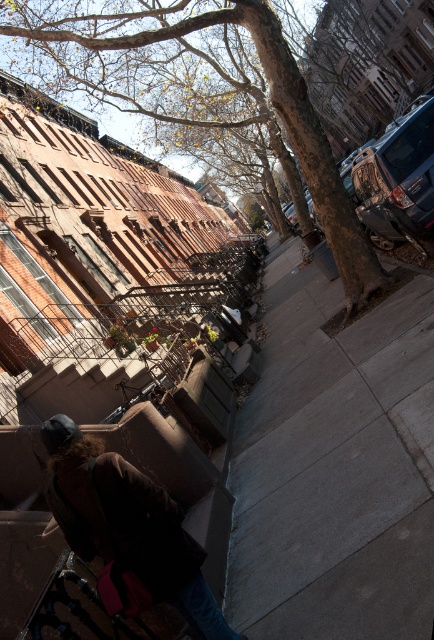
Question: Is brown textured tree at upper center below dark brown leather jacket at lower left?

Choices:
 (A) yes
 (B) no

Answer: (B)

Question: Which of the following is the farthest from the observer?

Choices:
 (A) (65, 506)
 (B) (329, 188)
 (C) (318, 422)

Answer: (B)

Question: Which point is farther to the camera?

Choices:
 (A) dark brown leather jacket at lower left
 (B) gray concrete sidewalk at center
 (C) brown textured tree at upper center

Answer: (C)

Question: Does gray concrete sidewalk at center appear on the left side of brown textured tree at upper center?

Choices:
 (A) yes
 (B) no

Answer: (B)

Question: Among these objects, which one is nearest to the camera?

Choices:
 (A) dark brown leather jacket at lower left
 (B) gray concrete sidewalk at center

Answer: (B)

Question: Is gray concrete sidewalk at center positioned before dark brown leather jacket at lower left?

Choices:
 (A) yes
 (B) no

Answer: (A)